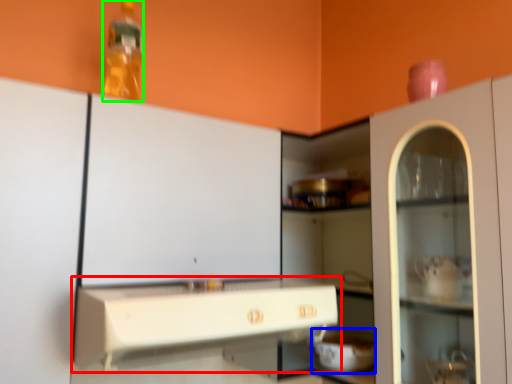
Question: Which object is the closest to the countertop (highlighted by a red box)? Choose among these: appliance (highlighted by a blue box) or bottle (highlighted by a green box).

Choices:
 (A) appliance
 (B) bottle

Answer: (A)